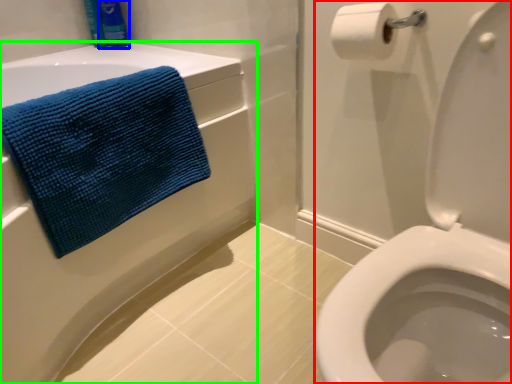
Question: Based on their relative distances, which object is nearer to sit (highlighted by a red box)? Choose from toiletry (highlighted by a blue box) and bath (highlighted by a green box).

Choices:
 (A) toiletry
 (B) bath

Answer: (B)